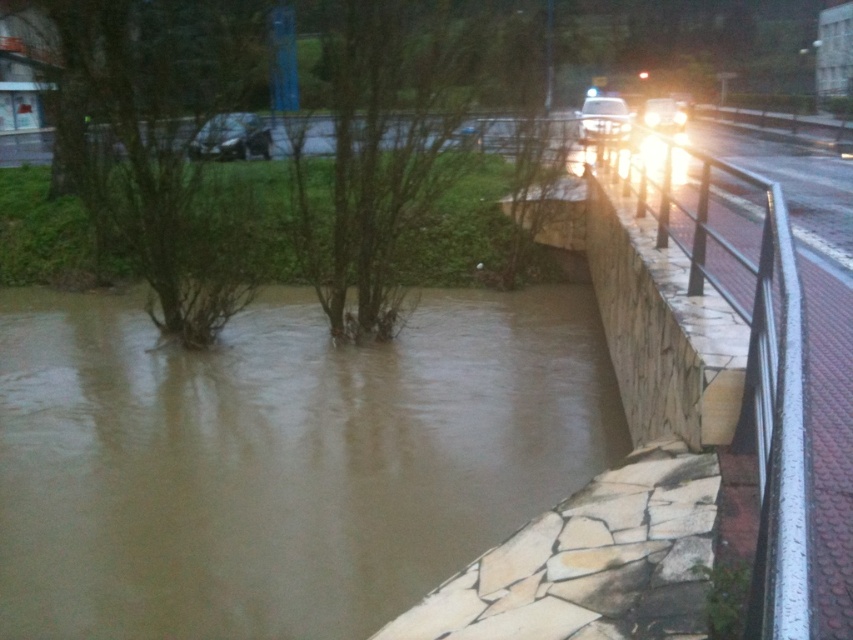
Question: Does white plastic car at upper center come in front of shiny silver car at upper center?

Choices:
 (A) no
 (B) yes

Answer: (B)

Question: Is brown muddy water at lower left below metallic silver car at upper left?

Choices:
 (A) yes
 (B) no

Answer: (A)

Question: Can you confirm if metallic silver car at upper left is positioned to the right of shiny silver car at upper center?

Choices:
 (A) yes
 (B) no

Answer: (B)

Question: Which point is closer to the camera?

Choices:
 (A) (579, 124)
 (B) (216, 140)
 (C) (352, 417)

Answer: (C)

Question: Which point is farther to the camera?

Choices:
 (A) metallic silver car at upper left
 (B) brown muddy water at lower left
 (C) white plastic car at upper center
 (D) shiny silver car at upper center

Answer: (D)

Question: Which object is the farthest from the brown muddy water at lower left?

Choices:
 (A) shiny silver car at upper center
 (B) metallic silver car at upper left

Answer: (A)